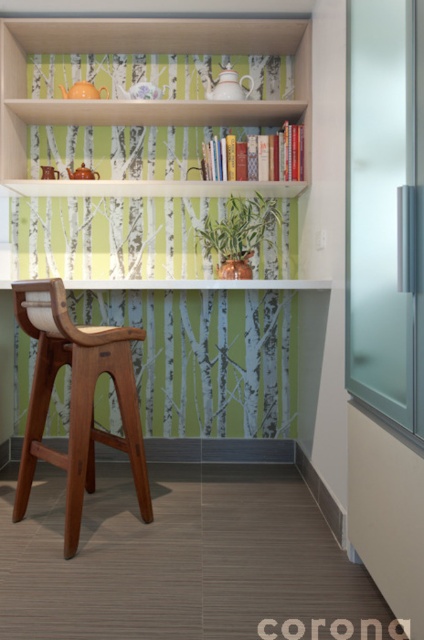
Between matte wood bookcase at upper center and white wood shelf at upper center, which one is positioned lower?

matte wood bookcase at upper center is lower down.

Is point (0, 308) positioned before point (214, 22)?

No.

The height and width of the screenshot is (640, 424). What do you see at coordinates (323, 259) in the screenshot? I see `matte wood bookcase at upper center` at bounding box center [323, 259].

Where is `matte wood bookcase at upper center`? The width and height of the screenshot is (424, 640). matte wood bookcase at upper center is located at coordinates (323, 259).

Which is more to the left, matte wood bookcase at upper center or mahogany wood chair at center?

Positioned to the left is mahogany wood chair at center.

Does matte wood bookcase at upper center appear on the left side of mahogany wood chair at center?

Incorrect, matte wood bookcase at upper center is not on the left side of mahogany wood chair at center.

Between point (314, 45) and point (117, 352), which one is positioned in front?

Point (117, 352) is in front.

Find the location of `matte wood bookcase at upper center`. matte wood bookcase at upper center is located at coordinates (323, 259).

Looking at this image, can you confirm if white wood shelf at upper center is bigger than mahogany wood chair at center?

Yes, white wood shelf at upper center is bigger than mahogany wood chair at center.

Can you confirm if white wood shelf at upper center is shorter than mahogany wood chair at center?

Indeed, white wood shelf at upper center has a lesser height compared to mahogany wood chair at center.

Does point (309, 20) come in front of point (92, 435)?

No, it is behind (92, 435).

Find the location of a particular element. The image size is (424, 640). white wood shelf at upper center is located at coordinates (134, 100).